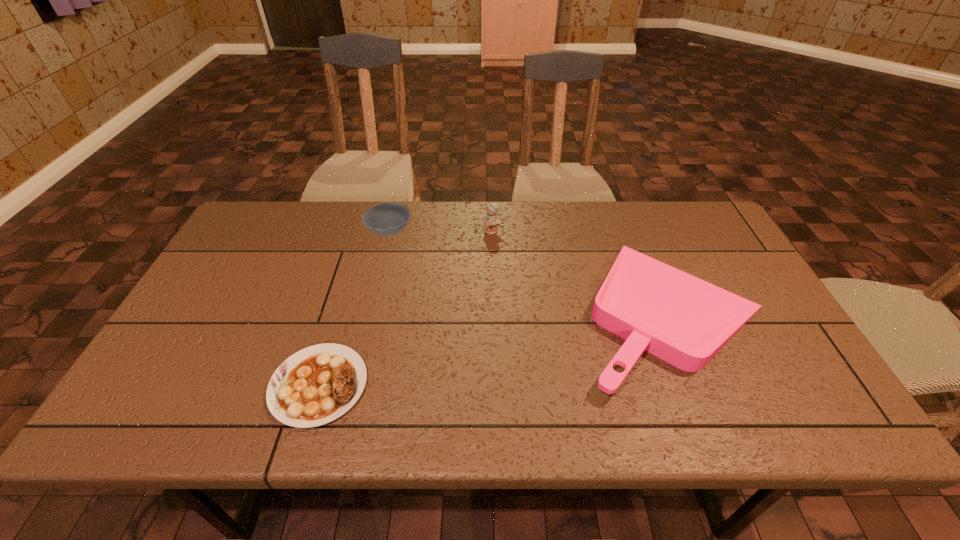
Find the location of `vacant space at the near edge of the desktop`. vacant space at the near edge of the desktop is located at coordinates (603, 418).

The image size is (960, 540). Find the location of `blank space at the left edge of the desktop`. blank space at the left edge of the desktop is located at coordinates (244, 287).

Find the location of a particular element. This screenshot has width=960, height=540. vacant space at the right edge is located at coordinates click(729, 344).

Locate an element on the screen. free space at the far right corner of the desktop is located at coordinates (668, 222).

At what (x,y) coordinates should I click in order to perform the action: click on empty space between the bowl and the steak. Please return your answer as a coordinate pair (x, y). Image resolution: width=960 pixels, height=540 pixels. Looking at the image, I should click on (354, 308).

This screenshot has width=960, height=540. I want to click on vacant area between the bowl and the shortest object, so click(354, 308).

I want to click on empty space that is in between the bowl and the tallest object, so click(x=441, y=231).

Where is `free space between the teddy bear and the bowl`? The image size is (960, 540). free space between the teddy bear and the bowl is located at coordinates (441, 231).

I want to click on vacant region between the bowl and the steak, so click(x=354, y=308).

Identify the location of unoccupied position between the bowl and the rightmost object. (530, 272).